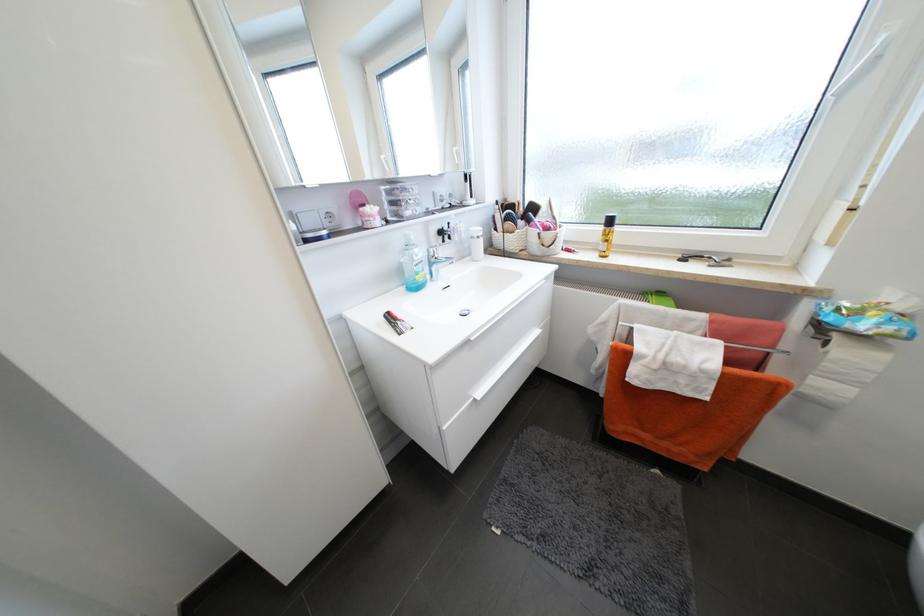
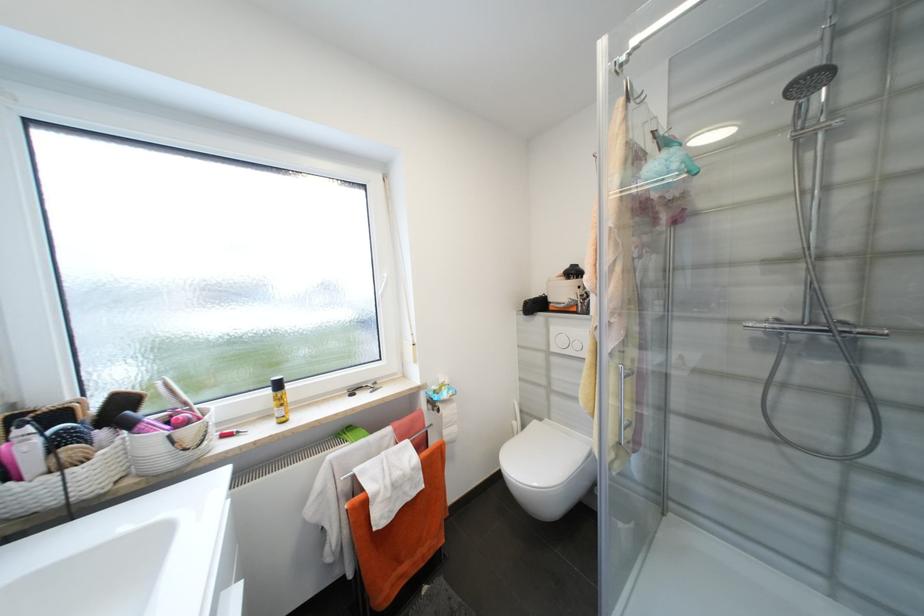
Find the pixel in the second image that matches point (535, 223) in the first image.

(134, 427)